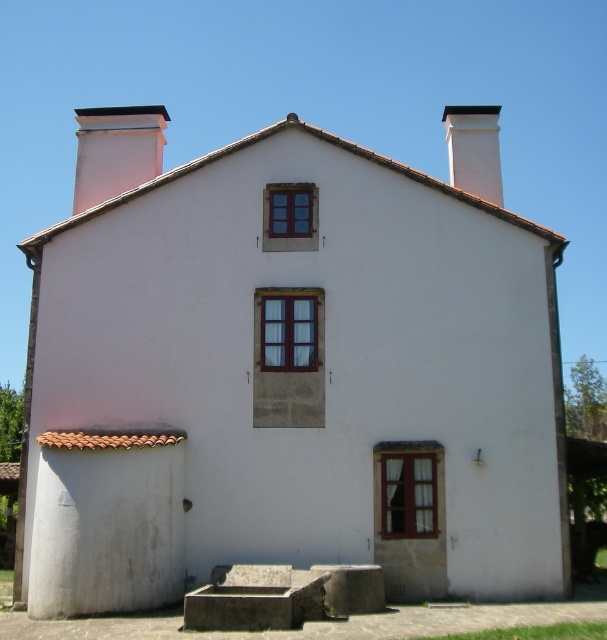
Can you confirm if white smooth chimney at upper left is positioned above white smooth chimney at upper center?

No, white smooth chimney at upper left is not above white smooth chimney at upper center.

Which is behind, point (75, 131) or point (464, 128)?

Positioned behind is point (75, 131).

Measure the distance between point (104, 168) and camera.

The distance of point (104, 168) from camera is 19.13 meters.

The height and width of the screenshot is (640, 607). Identify the location of white smooth chimney at upper left. (117, 150).